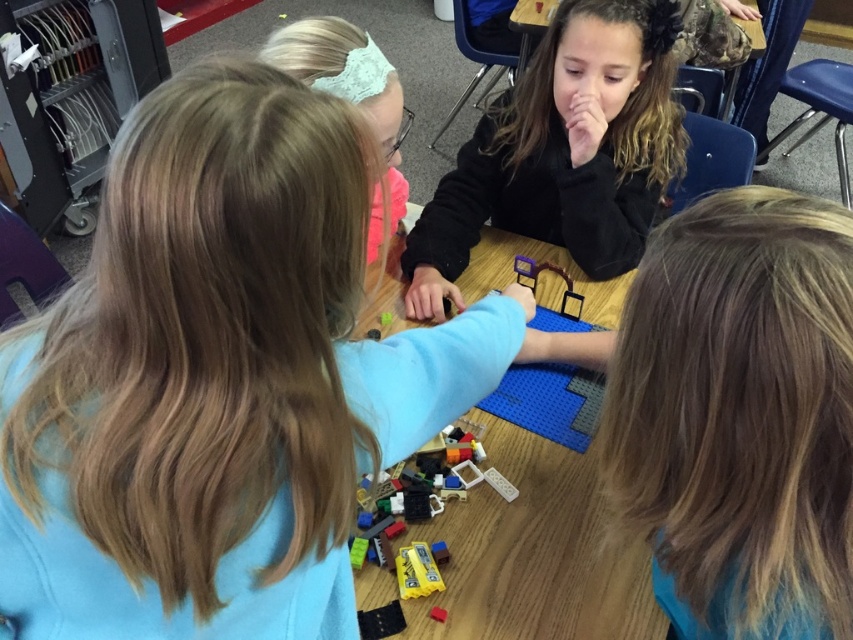
Does black matte jacket at center have a lesser width compared to light blue lace headband at upper center?

Incorrect, black matte jacket at center's width is not less than light blue lace headband at upper center's.

From the picture: Does black matte jacket at center appear under light blue lace headband at upper center?

No, black matte jacket at center is not below light blue lace headband at upper center.

Who is more forward, (618, 227) or (288, 52)?

Positioned in front is point (288, 52).

Locate an element on the screen. This screenshot has height=640, width=853. black matte jacket at center is located at coordinates (563, 150).

Can you confirm if blue plastic table at center is taller than light blue lace headband at upper center?

In fact, blue plastic table at center may be shorter than light blue lace headband at upper center.

Is point (618, 582) positioned before point (367, 81)?

Yes, it is.

Image resolution: width=853 pixels, height=640 pixels. What do you see at coordinates (534, 554) in the screenshot? I see `blue plastic table at center` at bounding box center [534, 554].

Where is `blue plastic table at center`? Image resolution: width=853 pixels, height=640 pixels. blue plastic table at center is located at coordinates (534, 554).

Is blonde hair at lower right to the right of translucent plastic toy at center from the viewer's perspective?

Indeed, blonde hair at lower right is positioned on the right side of translucent plastic toy at center.

Who is higher up, blonde hair at lower right or translucent plastic toy at center?

Positioned higher is translucent plastic toy at center.

Identify the location of blonde hair at lower right. Image resolution: width=853 pixels, height=640 pixels. (740, 416).

In order to click on blonde hair at lower right in this screenshot , I will do `click(740, 416)`.